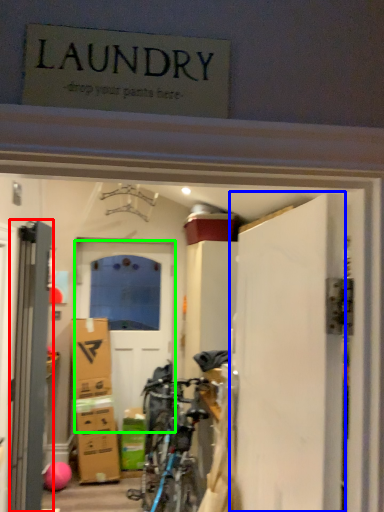
Question: Which is nearer to the door (highlighted by a red box)? door (highlighted by a blue box) or door (highlighted by a green box).

Choices:
 (A) door
 (B) door

Answer: (A)